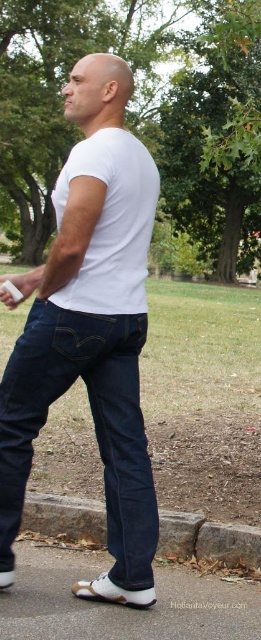
You are a photographer trying to capture the person in the white V neck T shirt. The person is standing at point (91, 330). You want to position your camera so that the white V neck T shirt is centered in the frame. Is the white matte t shirt at center in the way?

The white matte t shirt at center is located at point (91, 330), which is exactly where the person is standing. Therefore, the white matte t shirt at center is in the way and would block the view of the person.